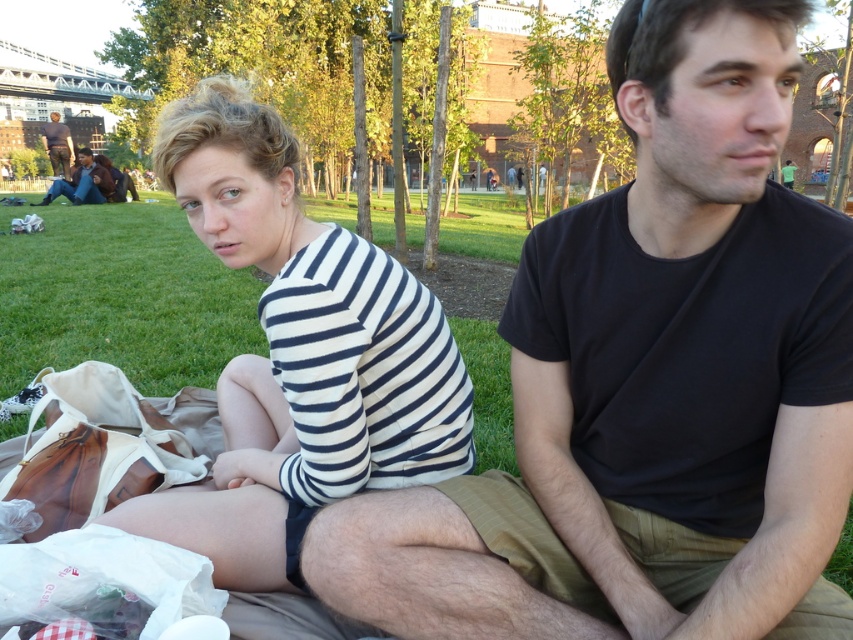
Question: Which object appears closest to the camera in this image?

Choices:
 (A) brown leather jacket at lower left
 (B) black cotton t-shirt at center

Answer: (B)

Question: Which object is the closest to the dark brown leather jacket at upper left?

Choices:
 (A) black cotton t-shirt at center
 (B) brown leather jacket at lower left
 (C) white striped shirt at center

Answer: (B)

Question: Can you confirm if brown leather jacket at lower left is positioned above dark brown leather jacket at upper left?

Choices:
 (A) no
 (B) yes

Answer: (A)

Question: Is brown leather jacket at lower left below dark brown leather jacket at upper left?

Choices:
 (A) no
 (B) yes

Answer: (B)

Question: Is black cotton t-shirt at center positioned behind dark brown leather jacket at upper left?

Choices:
 (A) yes
 (B) no

Answer: (B)

Question: Which of the following is the closest to the observer?

Choices:
 (A) (70, 156)
 (B) (248, 484)
 (C) (534, 317)
 (D) (90, 196)

Answer: (C)